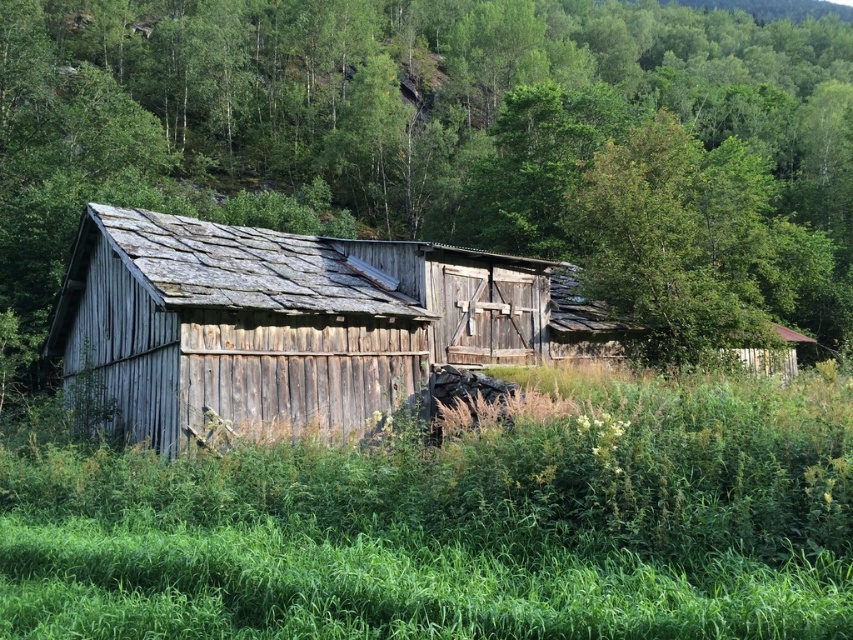
Is green grass at lower center thinner than weathered wood barn at center?

Indeed, green grass at lower center has a lesser width compared to weathered wood barn at center.

Which is below, green grass at lower center or weathered wood barn at center?

green grass at lower center is lower down.

Is point (670, 452) positioned after point (525, 301)?

No, (670, 452) is closer to viewer.

The width and height of the screenshot is (853, 640). Identify the location of green grass at lower center. (457, 525).

Does green wood tree at center come in front of green grass at lower center?

No, green wood tree at center is behind green grass at lower center.

At what (x,y) coordinates should I click in order to perform the action: click on green wood tree at center. Please return your answer as a coordinate pair (x, y). This screenshot has height=640, width=853. Looking at the image, I should click on (404, 116).

Is point (33, 212) positioned before point (335, 452)?

No, (33, 212) is behind (335, 452).

The image size is (853, 640). In order to click on green wood tree at center in this screenshot , I will do `click(404, 116)`.

Who is more forward, (265, 157) or (490, 346)?

Positioned in front is point (490, 346).

Which of these two, green wood tree at center or weathered wood barn at center, stands shorter?

weathered wood barn at center is shorter.

I want to click on green wood tree at center, so click(404, 116).